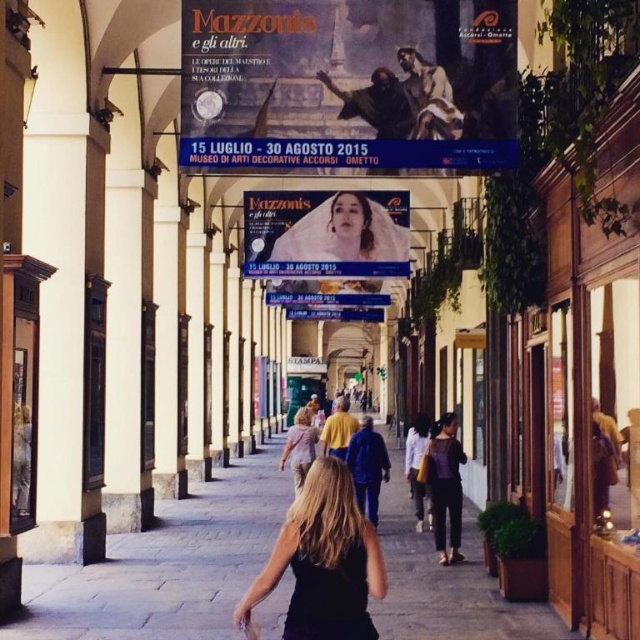
Question: Which point is closer to the camera taking this photo?

Choices:
 (A) (291, 630)
 (B) (163, 609)
 (C) (444, 481)
 (D) (388, 244)

Answer: (A)

Question: Which object is positioned closest to the matte oil painting at upper center?

Choices:
 (A) pastel pink fabric at center
 (B) black satin dress at center
 (C) paved stone pavement at center

Answer: (B)

Question: Considering the relative positions of matte oil painting at upper center and paved stone pavement at center in the image provided, where is matte oil painting at upper center located with respect to paved stone pavement at center?

Choices:
 (A) right
 (B) left

Answer: (A)

Question: Which point appears closest to the camera in this image?

Choices:
 (A) (454, 541)
 (B) (310, 240)

Answer: (A)

Question: Does matte oil painting at upper center appear on the right side of dark brown leather jacket at center?

Choices:
 (A) no
 (B) yes

Answer: (A)

Question: Does paved stone pavement at center have a larger size compared to matte white fabric at upper center?

Choices:
 (A) yes
 (B) no

Answer: (A)